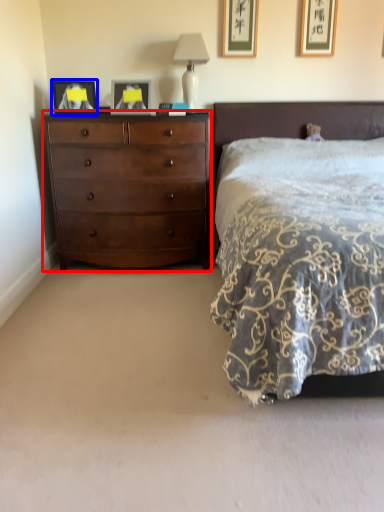
Question: Which object appears farthest to the camera in this image, chest of drawers (highlighted by a red box) or picture frame (highlighted by a blue box)?

Choices:
 (A) chest of drawers
 (B) picture frame

Answer: (B)